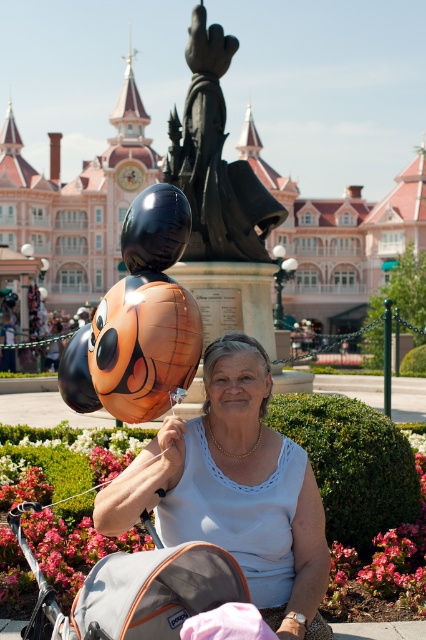
From the picture: Which of these two, white fabric shirt at center or gray fabric baby carriage at lower center, stands shorter?

gray fabric baby carriage at lower center

The height and width of the screenshot is (640, 426). What do you see at coordinates (235, 490) in the screenshot? I see `white fabric shirt at center` at bounding box center [235, 490].

Who is more forward, (204, 508) or (121, 625)?

Point (121, 625)

Locate an element on the screen. white fabric shirt at center is located at coordinates (235, 490).

Does gray fabric baby carriage at lower center have a lesser width compared to black polished statue at center?

No, gray fabric baby carriage at lower center is not thinner than black polished statue at center.

Which is more to the left, gray fabric baby carriage at lower center or black polished statue at center?

Positioned to the left is gray fabric baby carriage at lower center.

Does point (158, 634) lie in front of point (207, 164)?

That is True.

Find the location of a particular element. gray fabric baby carriage at lower center is located at coordinates (135, 589).

Describe the element at coordinates (235, 490) in the screenshot. I see `white fabric shirt at center` at that location.

Is point (121, 480) more distant than point (201, 32)?

No, it is not.

This screenshot has width=426, height=640. In order to click on white fabric shirt at center in this screenshot , I will do `click(235, 490)`.